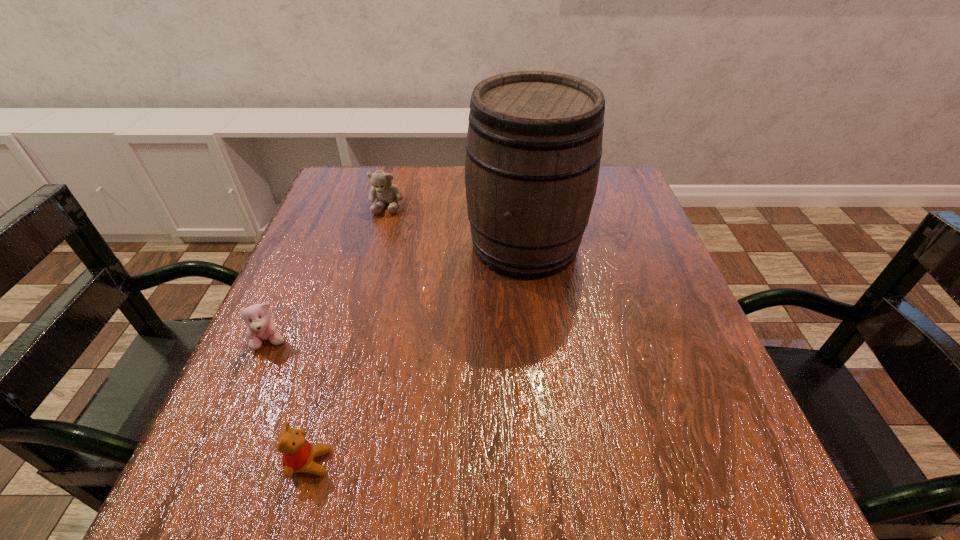
In order to click on vacant area that lies between the farthest teddy bear and the nearest teddy bear in this screenshot , I will do `click(348, 334)`.

Find the location of a particular element. vacant point located between the second nearest object and the nearest teddy bear is located at coordinates (290, 402).

The image size is (960, 540). In order to click on object that stands as the closest to the third farthest object in this screenshot , I will do `click(298, 454)`.

Where is `object that stands as the second closest to the third farthest object`? This screenshot has width=960, height=540. object that stands as the second closest to the third farthest object is located at coordinates (534, 144).

This screenshot has width=960, height=540. Identify the location of teddy bear that is the second closest to the third farthest object. [382, 188].

Identify which teddy bear is the second closest to the nearest object. Please provide its 2D coordinates. Your answer should be formatted as a tuple, i.e. [(x, y)], where the tuple contains the x and y coordinates of a point satisfying the conditions above.

[(382, 188)]

At what (x,y) coordinates should I click in order to perform the action: click on free space that satisfies the following two spatial constraints: 1. on the face of the farthest teddy bear; 2. on the front-facing side of the nearest object. Please return your answer as a coordinate pair (x, y). The image size is (960, 540). Looking at the image, I should click on pos(316,462).

Where is `free point that satisfies the following two spatial constraints: 1. on the face of the farthest teddy bear; 2. on the front-facing side of the nearest teddy bear`? free point that satisfies the following two spatial constraints: 1. on the face of the farthest teddy bear; 2. on the front-facing side of the nearest teddy bear is located at coordinates (316, 462).

The height and width of the screenshot is (540, 960). Find the location of `vacant position in the image that satisfies the following two spatial constraints: 1. on the face of the farthest teddy bear; 2. on the front-facing side of the nearest teddy bear`. vacant position in the image that satisfies the following two spatial constraints: 1. on the face of the farthest teddy bear; 2. on the front-facing side of the nearest teddy bear is located at coordinates (316, 462).

Where is `vacant space that satisfies the following two spatial constraints: 1. on the front side of the rightmost object; 2. on the front-facing side of the nearest teddy bear`? vacant space that satisfies the following two spatial constraints: 1. on the front side of the rightmost object; 2. on the front-facing side of the nearest teddy bear is located at coordinates point(550,462).